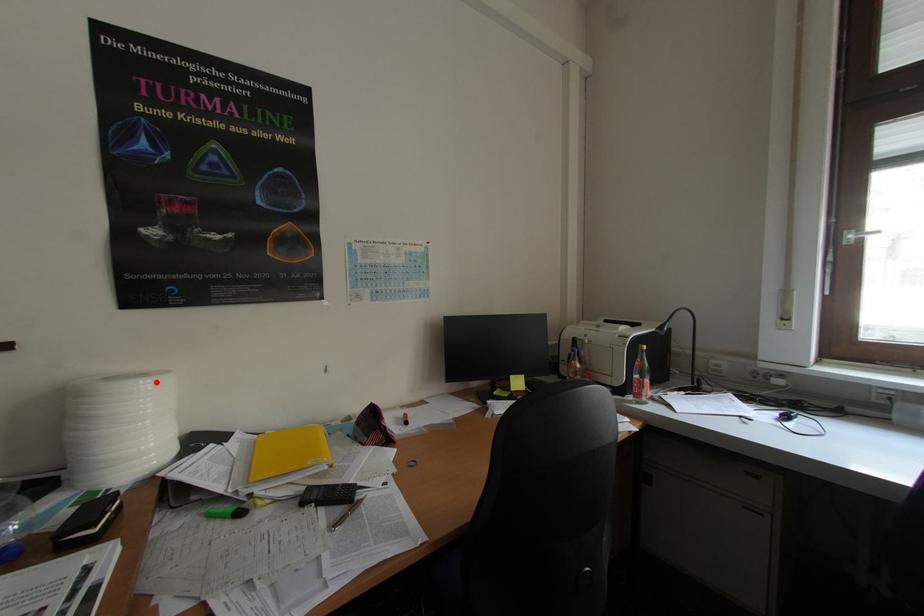
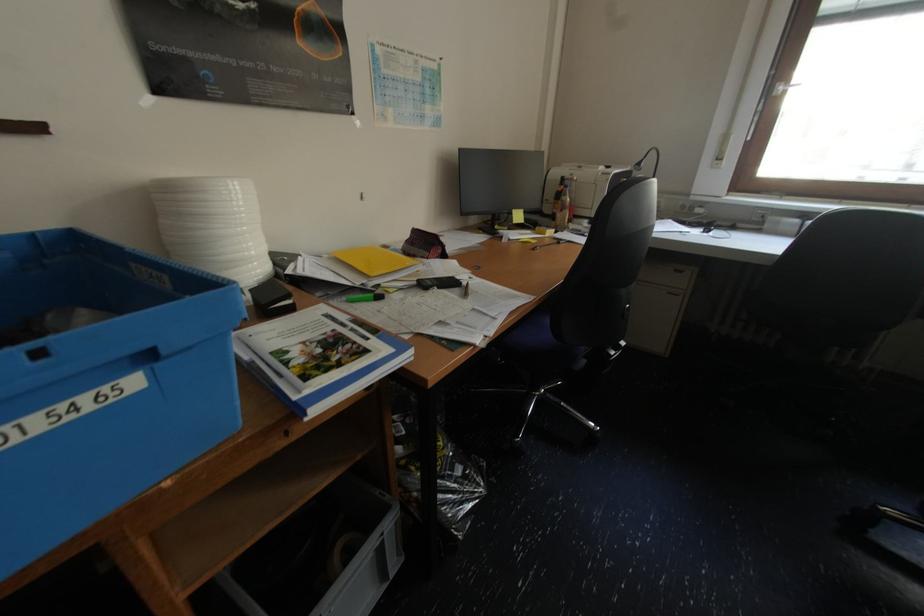
In the second image, find the point that corresponds to the highlighted location in the first image.

(246, 184)